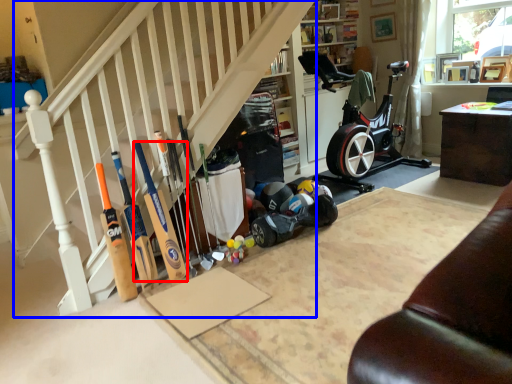
Question: Which object is closer to the camera taking this photo, baseball bat (highlighted by a red box) or stairwell (highlighted by a blue box)?

Choices:
 (A) baseball bat
 (B) stairwell

Answer: (B)